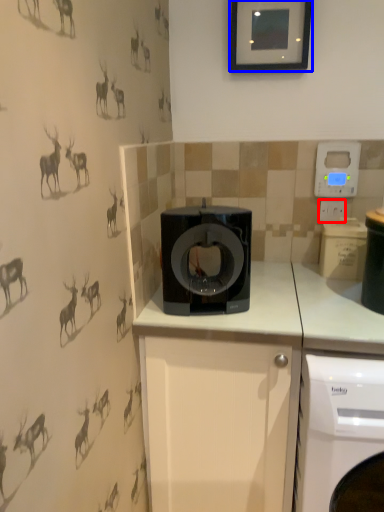
Question: Which object is closer to the camera taking this photo, electric outlet (highlighted by a red box) or picture frame (highlighted by a blue box)?

Choices:
 (A) electric outlet
 (B) picture frame

Answer: (B)